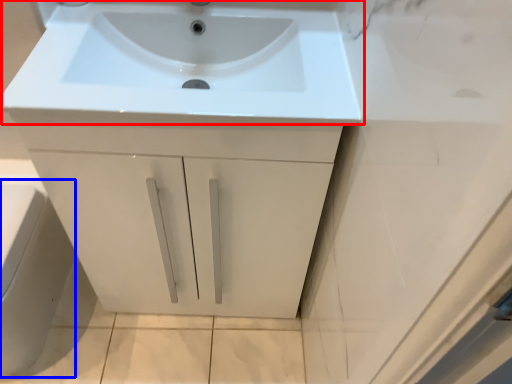
Question: Which point is closer to the camera, sink (highlighted by a red box) or porcelain (highlighted by a blue box)?

Choices:
 (A) sink
 (B) porcelain

Answer: (A)